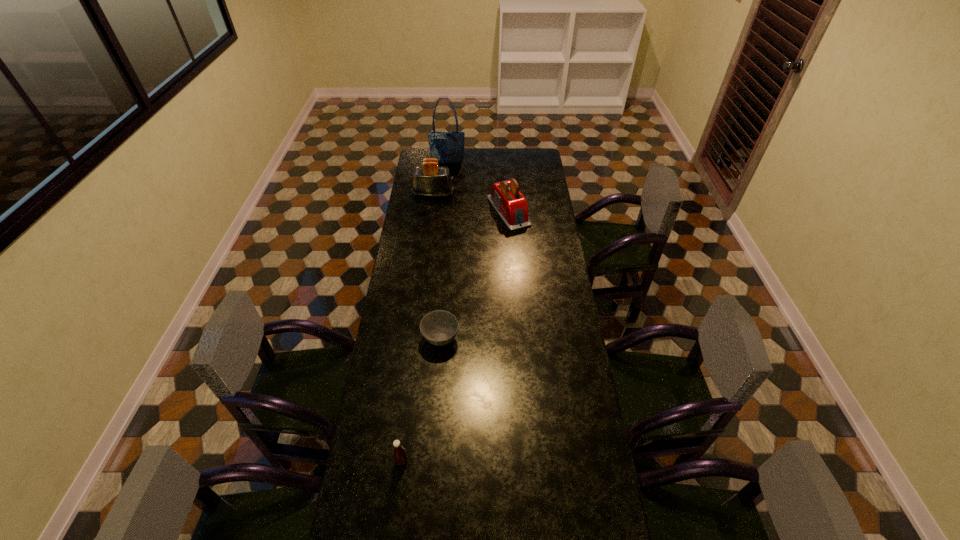
Image resolution: width=960 pixels, height=540 pixels. In order to click on free region at the far edge in this screenshot , I will do `click(501, 161)`.

Identify the location of vacant space at the left edge of the desktop. (429, 228).

This screenshot has height=540, width=960. Identify the location of vacant space at the right edge of the desktop. (541, 294).

Where is `blank region between the left toaster and the Tabasco sauce`? This screenshot has height=540, width=960. blank region between the left toaster and the Tabasco sauce is located at coordinates (418, 327).

Image resolution: width=960 pixels, height=540 pixels. I want to click on free space between the left toaster and the Tabasco sauce, so click(x=418, y=327).

Where is `vacant area between the left toaster and the nearest object`? This screenshot has width=960, height=540. vacant area between the left toaster and the nearest object is located at coordinates point(418,327).

Identify the location of unoccupied area between the nearest object and the farthest object. (424, 312).

Locate an element on the screen. The image size is (960, 540). vacant space in between the second shortest object and the left toaster is located at coordinates (418, 327).

Find the location of a particular element. The image size is (960, 540). free space between the fourth farthest object and the right toaster is located at coordinates click(474, 275).

Identify the location of unoccupied position between the farthest object and the second shortest object. (424, 312).